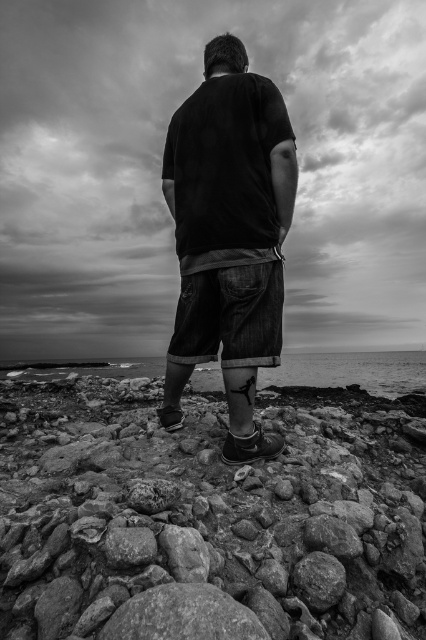
Where is `smooth rock at center`? The height and width of the screenshot is (640, 426). smooth rock at center is located at coordinates (207, 516).

Who is lower down, smooth rock at center or smooth water at lower center?

smooth water at lower center is below.

I want to click on smooth rock at center, so click(207, 516).

Locate an element on the screen. This screenshot has width=426, height=640. smooth rock at center is located at coordinates (207, 516).

Consider the image. Is denim shorts at center behind smooth water at lower center?

That is False.

Who is lower down, denim shorts at center or smooth water at lower center?

Positioned lower is smooth water at lower center.

Between point (241, 44) and point (402, 374), which one is positioned in front?

Point (241, 44)

The width and height of the screenshot is (426, 640). I want to click on denim shorts at center, so click(229, 236).

Is smooth rock at center above denim shorts at center?

Actually, smooth rock at center is below denim shorts at center.

Does smooth rock at center appear on the left side of denim shorts at center?

Incorrect, smooth rock at center is not on the left side of denim shorts at center.

Identify the location of smooth rock at center. This screenshot has width=426, height=640. (207, 516).

You are a GUI agent. You are given a task and a screenshot of the screen. Output one action in this format:
    pyautogui.click(x=<x>, y=<y>)
    Task: Click on the smooth rock at center
    The image size is (426, 640).
    Given the screenshot: What is the action you would take?
    pyautogui.click(x=207, y=516)